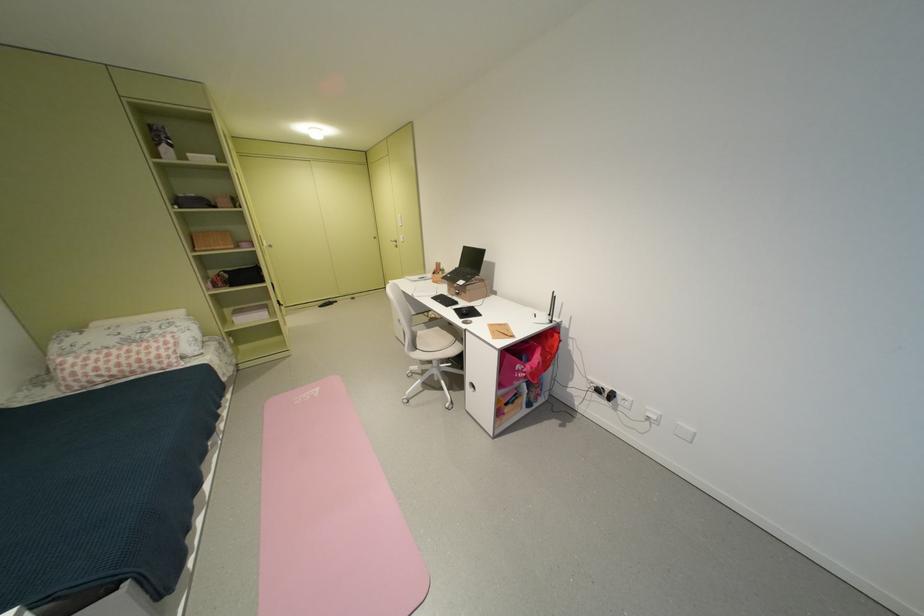
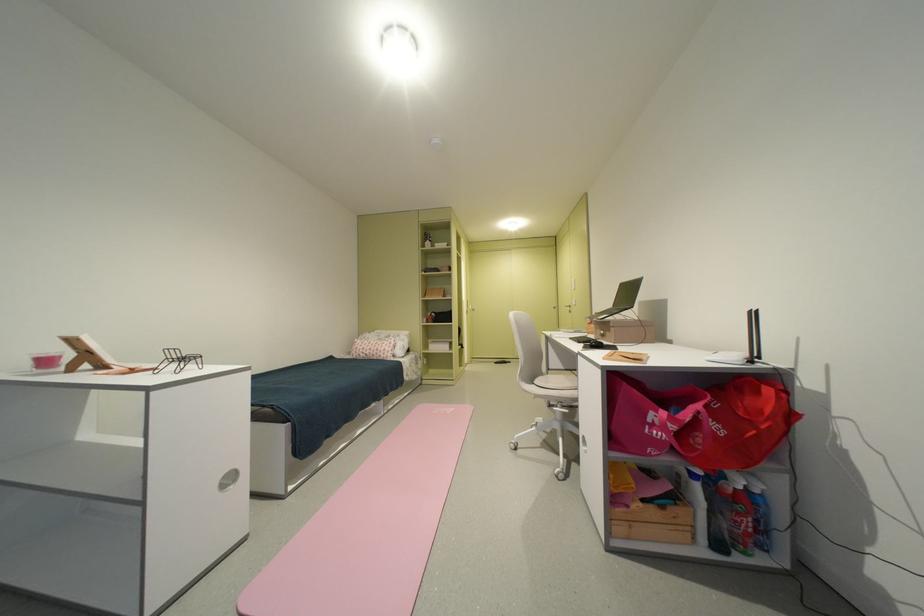
Where in the second image is the point corresponding to pixel 475 294 from the first image?

(618, 331)